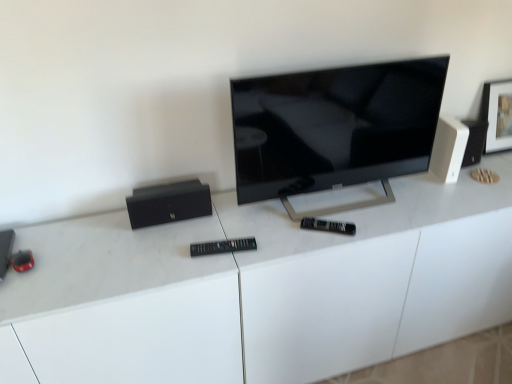
This screenshot has width=512, height=384. In order to click on free space on the front side of black glossy tv at center in this screenshot , I will do `click(339, 233)`.